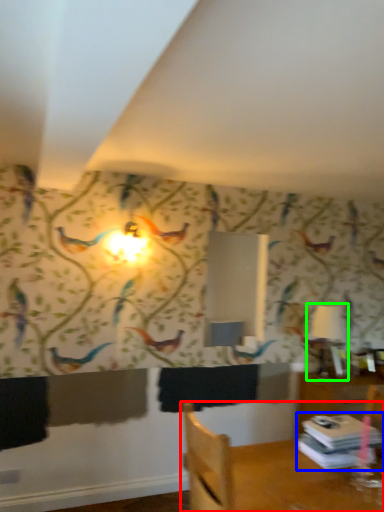
Question: Which object is positioned farthest from furniture (highlighted by a red box)? Select from book (highlighted by a blue box) and table lamp (highlighted by a green box).

Choices:
 (A) book
 (B) table lamp

Answer: (B)